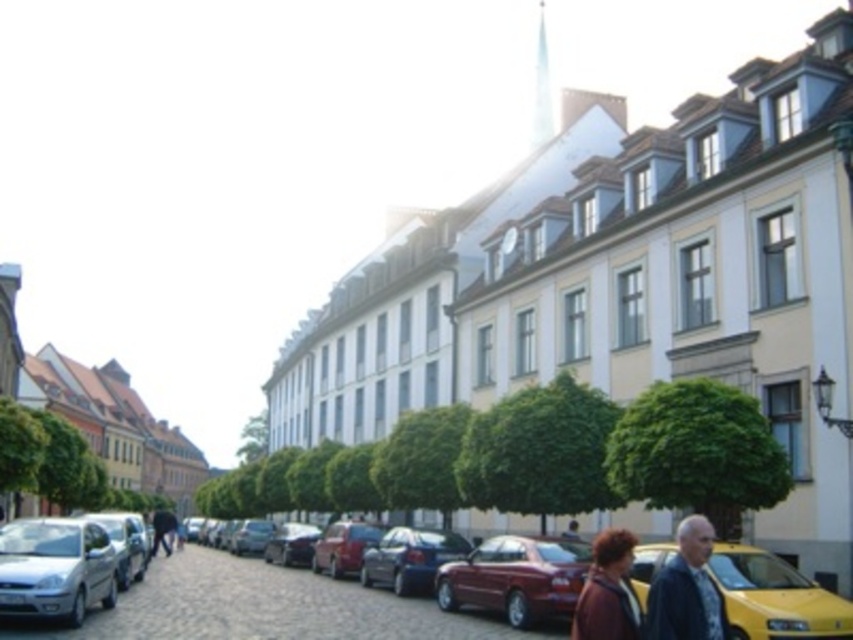
Question: Which of the following is the closest to the observer?

Choices:
 (A) metallic red car at center
 (B) shiny red convertible at center
 (C) yellow matte taxi at lower right
 (D) brown leather jacket at lower right

Answer: (D)

Question: Can you confirm if shiny blue sedan at center is bigger than dark blue jeans at center?

Choices:
 (A) no
 (B) yes

Answer: (A)

Question: Which of the following is the farthest from the observer?

Choices:
 (A) dark blue jacket at lower right
 (B) shiny red convertible at center
 (C) shiny blue sedan at center

Answer: (C)

Question: Considering the relative positions of brown leather jacket at lower right and shiny blue sedan at center in the image provided, where is brown leather jacket at lower right located with respect to shiny blue sedan at center?

Choices:
 (A) left
 (B) right

Answer: (B)

Question: Which object appears closest to the camera in this image?

Choices:
 (A) brown leather jacket at lower right
 (B) yellow matte taxi at lower right
 (C) dark blue jacket at lower right
 (D) shiny blue sedan at center

Answer: (C)

Question: Is shiny blue sedan at center further to the viewer compared to dark blue jeans at center?

Choices:
 (A) yes
 (B) no

Answer: (B)